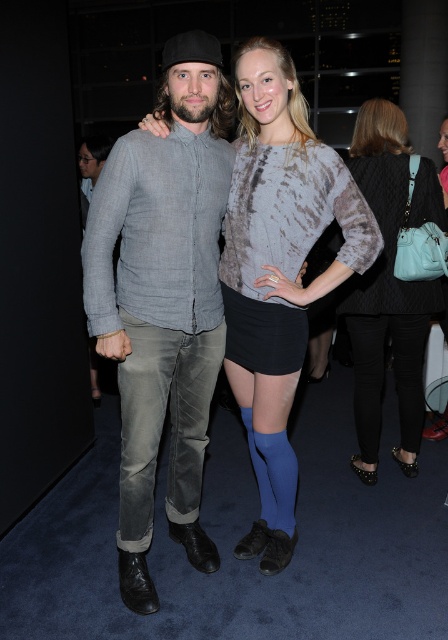
Question: Estimate the real-world distances between objects in this image. Which object is closer to the black leather pants at lower right?

Choices:
 (A) denim jeans at center
 (B) washed denim jeans at center
 (C) denim shirt at center
 (D) blue tights at center

Answer: (D)

Question: Does washed denim jeans at center have a greater width compared to blue smooth sock at lower center?

Choices:
 (A) no
 (B) yes

Answer: (B)

Question: Estimate the real-world distances between objects in this image. Which object is closer to the black leather pants at lower right?

Choices:
 (A) washed denim jeans at center
 (B) textured gray sweater at center

Answer: (B)

Question: Can you confirm if denim jeans at center is wider than blue tights at center?

Choices:
 (A) yes
 (B) no

Answer: (A)

Question: Estimate the real-world distances between objects in this image. Which object is farther from the black leather pants at lower right?

Choices:
 (A) denim jeans at center
 (B) blue smooth sock at lower center

Answer: (A)

Question: Considering the relative positions of textured gray sweater at center and blue smooth sock at lower center in the image provided, where is textured gray sweater at center located with respect to blue smooth sock at lower center?

Choices:
 (A) below
 (B) above

Answer: (B)